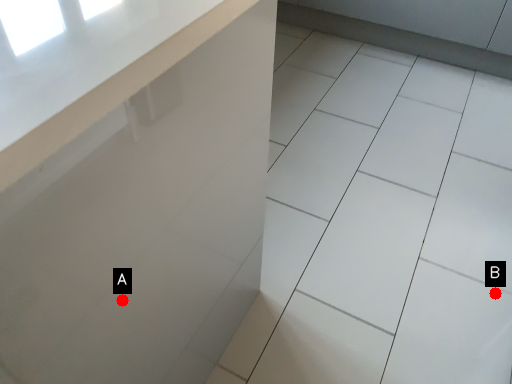
Question: Two points are circled on the image, labeled by A and B beside each circle. Which of the following is the farthest from the observer?

Choices:
 (A) A is further
 (B) B is further

Answer: (B)